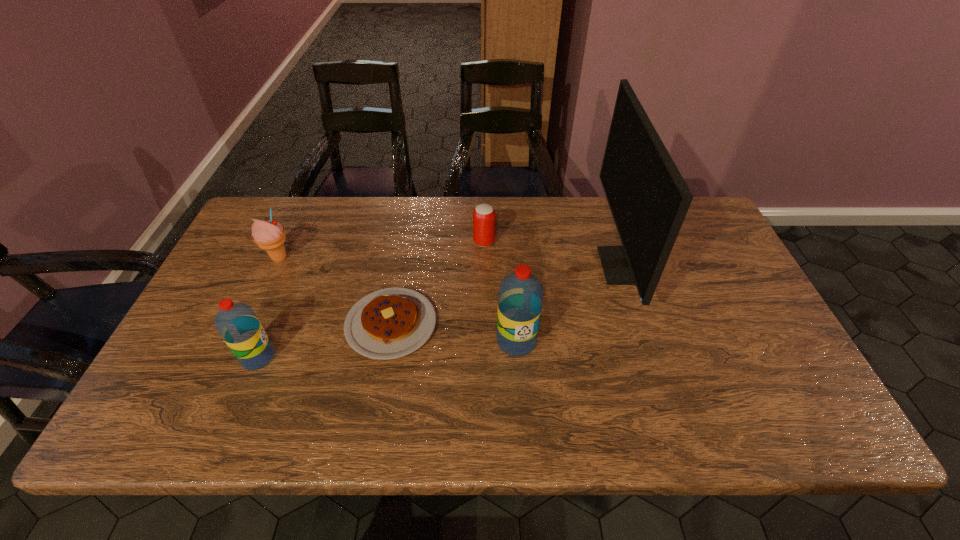
With all water bottles evenly spaced, where should an extra water bottle be placed on the right to continue the pattern? Please point out a vacant space. Please provide its 2D coordinates. Your answer should be formatted as a tuple, i.e. [(x, y)], where the tuple contains the x and y coordinates of a point satisfying the conditions above.

[(759, 326)]